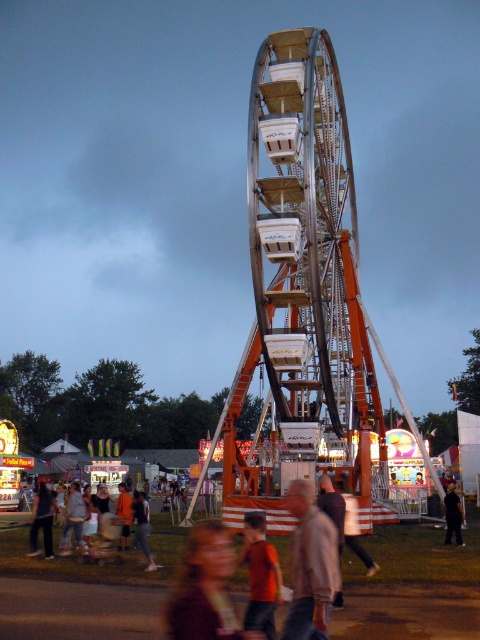
How distant is dark brown leather jacket at lower left from dark brown leather pants at lower center?

dark brown leather jacket at lower left is 28.94 meters from dark brown leather pants at lower center.

Does point (48, 554) come closer to viewer compared to point (355, 509)?

Yes.

The width and height of the screenshot is (480, 640). I want to click on dark brown leather jacket at lower left, so click(x=41, y=522).

You are a GUI agent. You are given a task and a screenshot of the screen. Output one action in this format:
    pyautogui.click(x=<x>, y=<y>)
    Task: Click on the dark brown leather jacket at lower left
    
    Given the screenshot: What is the action you would take?
    pyautogui.click(x=41, y=522)

Is metallic silver ferris wheel at center to the left of dark brown leather jacket at center from the viewer's perspective?

Incorrect, metallic silver ferris wheel at center is not on the left side of dark brown leather jacket at center.

Consider the image. Is metallic silver ferris wheel at center wider than dark brown leather jacket at center?

Yes, metallic silver ferris wheel at center is wider than dark brown leather jacket at center.

I want to click on metallic silver ferris wheel at center, so click(x=301, y=225).

Find the location of `metallic silver ferris wheel at center`. metallic silver ferris wheel at center is located at coordinates (301, 225).

Does point (324, 566) come behind point (255, 582)?

No.

Which of these two, light brown jacket at center or orange t-shirt at center, stands shorter?

orange t-shirt at center is shorter.

Locate an element on the screen. light brown jacket at center is located at coordinates (311, 564).